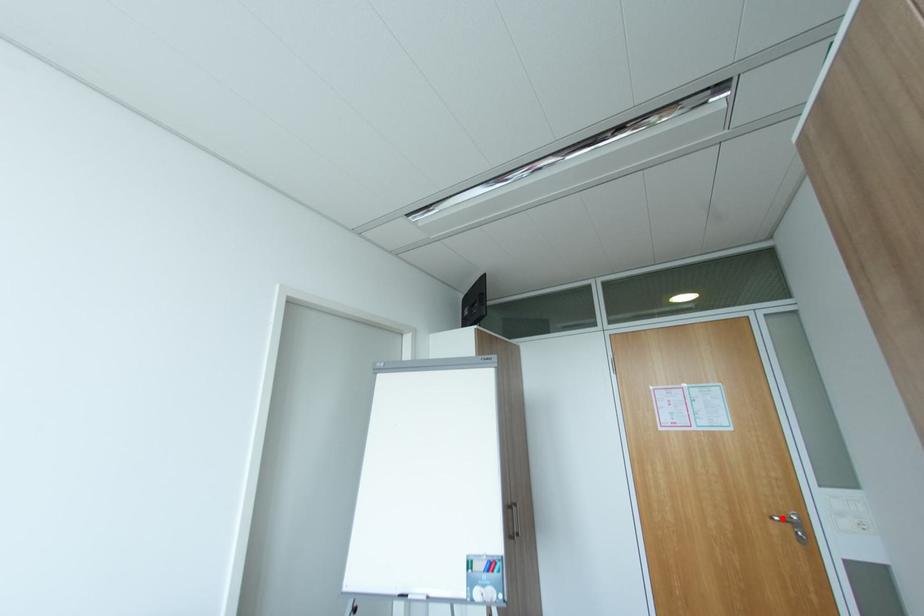
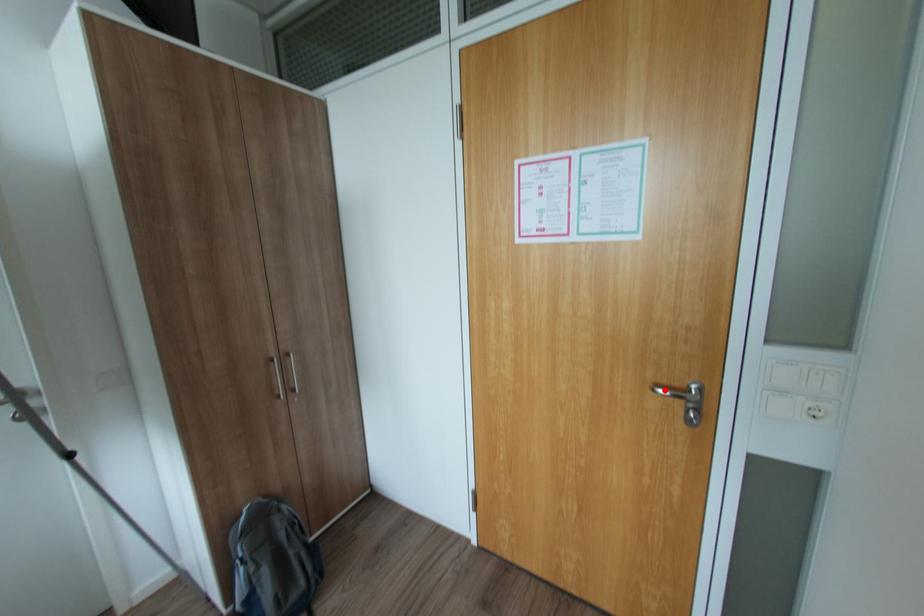
I am providing you with two images of the same scene from different viewpoints. A red point is marked on the first image and another point is marked on the second image. Do the highlighted points in image1 and image2 indicate the same real-world spot?

Yes